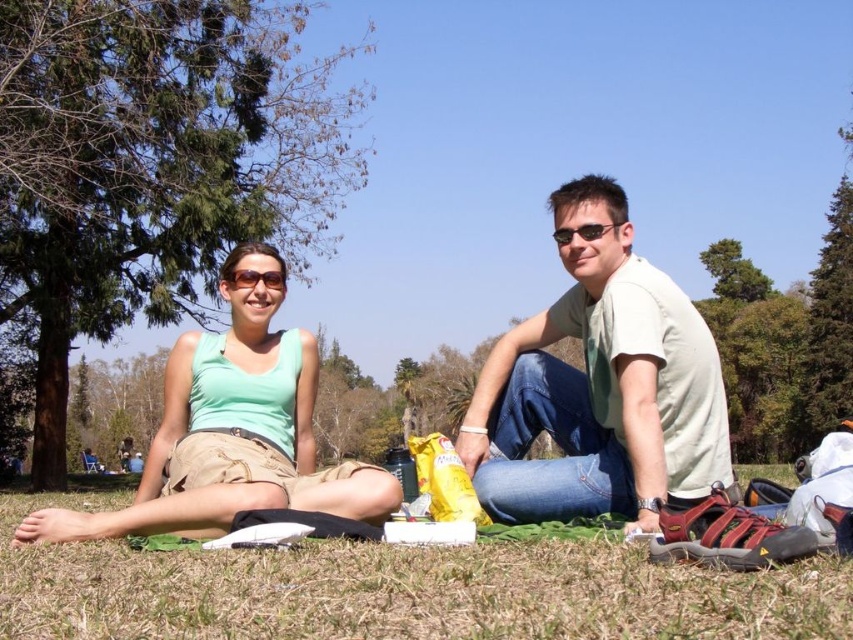
Is green fabric at center taller than light beige cotton shirt at center?

Indeed, green fabric at center has a greater height compared to light beige cotton shirt at center.

Who is more distant from viewer, (515, 474) or (593, 332)?

Point (593, 332)

Find the location of a particular element. green fabric at center is located at coordinates (601, 387).

Can you confirm if green fabric at center is wider than green matte tank top at center?

Indeed, green fabric at center has a greater width compared to green matte tank top at center.

Does green fabric at center appear under green matte tank top at center?

Actually, green fabric at center is above green matte tank top at center.

You are a GUI agent. You are given a task and a screenshot of the screen. Output one action in this format:
    pyautogui.click(x=<x>, y=<y>)
    Task: Click on the green fabric at center
    
    Given the screenshot: What is the action you would take?
    pyautogui.click(x=601, y=387)

The width and height of the screenshot is (853, 640). Describe the element at coordinates (601, 387) in the screenshot. I see `green fabric at center` at that location.

Between green fabric at center and green grass at lower center, which one has more height?

With more height is green grass at lower center.

Find the location of a particular element. This screenshot has width=853, height=640. green fabric at center is located at coordinates (601, 387).

Locate an element on the screen. This screenshot has height=640, width=853. green fabric at center is located at coordinates (601, 387).